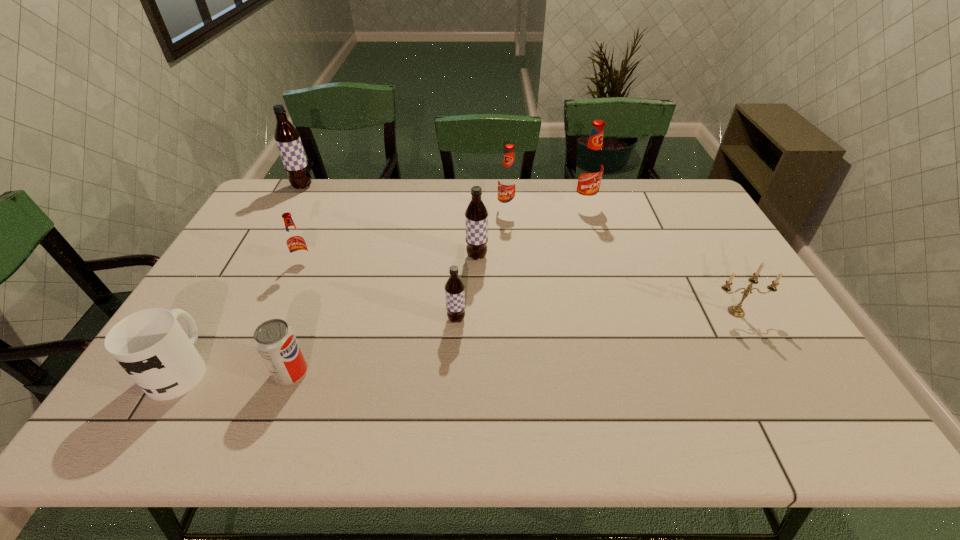
You are a GUI agent. You are given a task and a screenshot of the screen. Output one action in this format:
    pyautogui.click(x=<x>, y=<y>)
    Task: Click on the vacant space at the far edge
    
    Given the screenshot: What is the action you would take?
    pyautogui.click(x=541, y=201)

Locate an element on the screen. free space at the near edge of the desktop is located at coordinates (749, 401).

Identify the location of free spot at the right edge of the desktop. (740, 276).

Identify the location of vacant space at the far left corner of the desktop. (283, 196).

In the image, there is a desktop. Where is `vacant area at the far right corner`? The width and height of the screenshot is (960, 540). vacant area at the far right corner is located at coordinates (676, 201).

In the image, there is a desktop. In order to click on vacant region at the near right corner in this screenshot , I will do `click(814, 421)`.

I want to click on free space that is in between the soda and the metallic candle, so click(514, 342).

You are a GUI agent. You are given a task and a screenshot of the screen. Output one action in this format:
    pyautogui.click(x=<x>, y=<y>)
    Task: Click on the empty location between the nearest root beer and the soda
    The image size is (960, 540).
    Given the screenshot: What is the action you would take?
    [x=373, y=346]

Find the location of a particular element. The image size is (960, 540). free space between the rightmost object and the second object from right to left is located at coordinates (660, 258).

At what (x,y) coordinates should I click in order to perform the action: click on vacant space that's between the mug and the smallest brown root beer. Please return your answer as a coordinate pair (x, y). This screenshot has width=960, height=540. Looking at the image, I should click on (319, 343).